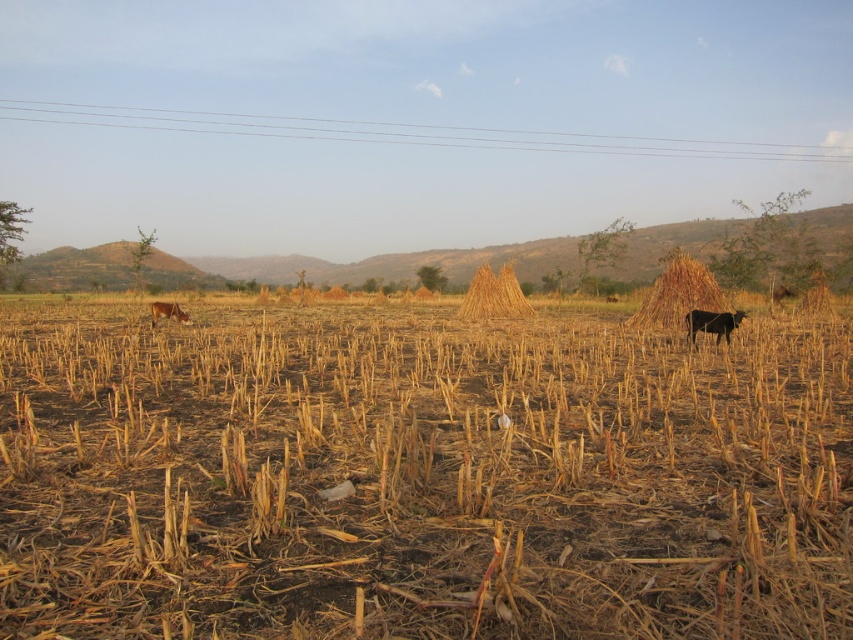
You are standing in the middle of the field and see a point marked at coordinate (419, 476). What is located at that point?

The point at coordinate (419, 476) indicates brown dry grass at center.

You are standing at the origin point in the field. Which direction should you walk to reach the braided straw stack at center?

The braided straw stack at center is located at point 0.463 in the x coordinate and 0.580 in the y coordinate. Since you are at the origin, you should walk northeast to reach it.

You are a farmer checking your field. You see the brown straw stack at right and the brown fur dog at lower left. Which object is larger in size?

The brown straw stack at right is bigger than the brown fur dog at lower left.